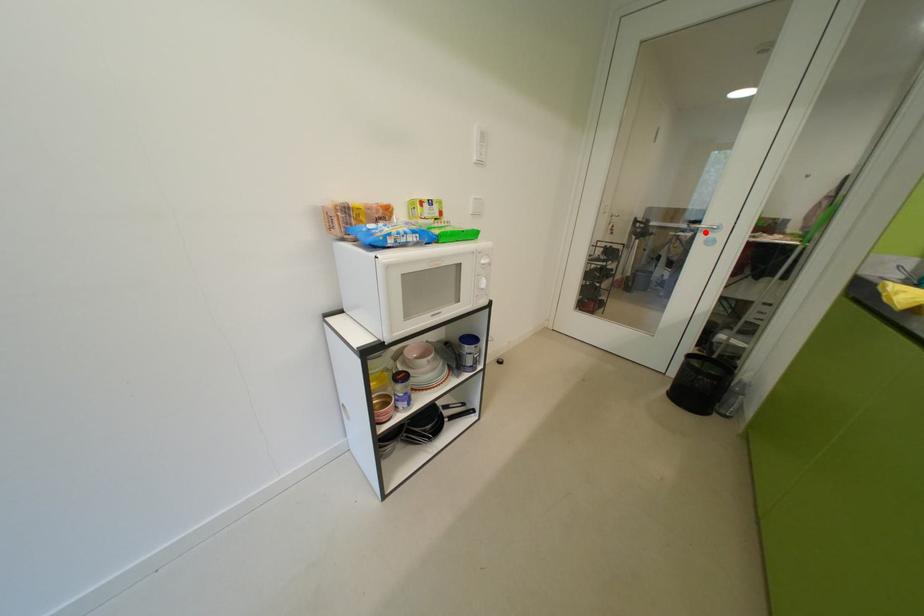
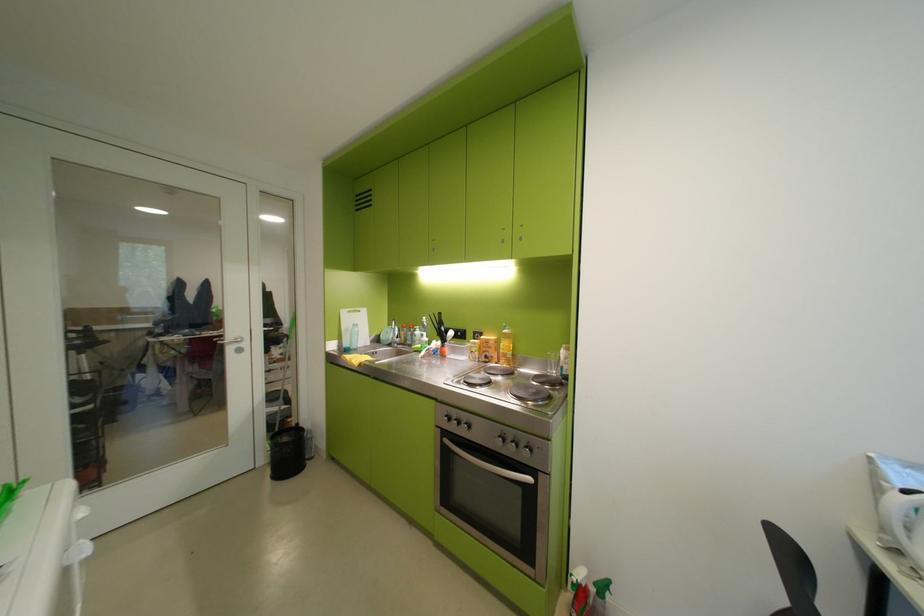
Question: I am providing you with two images of the same scene from different viewpoints. A red point is shown in image1. For the corresponding object point in image2, is it positioned nearer or farther from the camera?

Choices:
 (A) Nearer
 (B) Farther

Answer: (B)